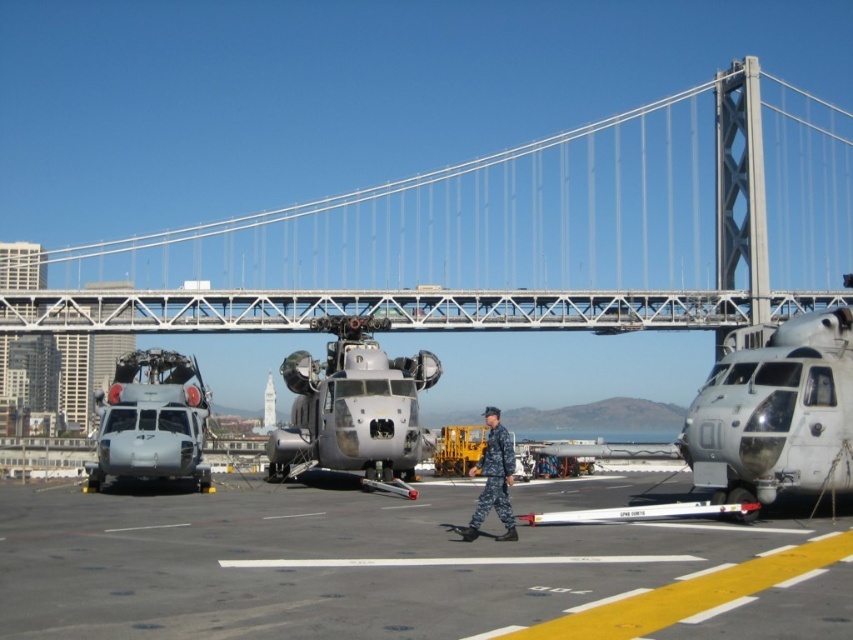
Does white metallic bridge at center have a lesser height compared to camouflage uniform at center?

Yes.

Who is shorter, white metallic bridge at center or camouflage uniform at center?

white metallic bridge at center is shorter.

Between point (625, 317) and point (498, 496), which one is positioned behind?

The point (625, 317) is behind.

Where is `white metallic bridge at center`? This screenshot has height=640, width=853. white metallic bridge at center is located at coordinates (398, 308).

Can you confirm if white metallic bridge at center is shorter than matte gray helicopter at left?

No, white metallic bridge at center is not shorter than matte gray helicopter at left.

What do you see at coordinates (398, 308) in the screenshot?
I see `white metallic bridge at center` at bounding box center [398, 308].

Where is `white metallic bridge at center`? white metallic bridge at center is located at coordinates point(398,308).

The width and height of the screenshot is (853, 640). In order to click on metallic gray helicopter at right in this screenshot , I will do `click(776, 413)`.

Between metallic gray helicopter at right and matte gray helicopter at left, which one is positioned lower?

matte gray helicopter at left is below.

The height and width of the screenshot is (640, 853). I want to click on metallic gray helicopter at right, so click(x=776, y=413).